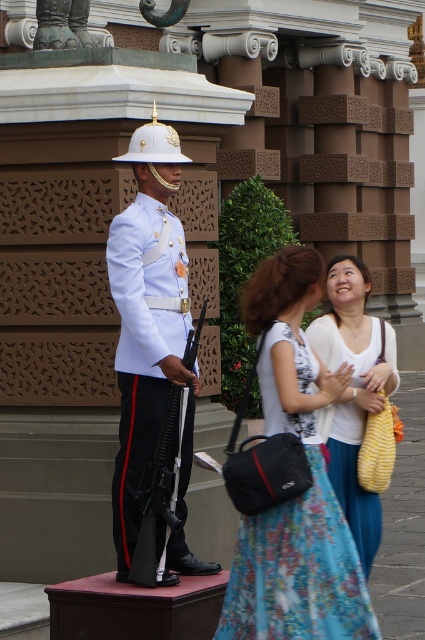
Can you confirm if floral dress at center is bigger than white fabric dress at center?

Correct, floral dress at center is larger in size than white fabric dress at center.

Is floral dress at center to the right of white fabric dress at center from the viewer's perspective?

In fact, floral dress at center is to the left of white fabric dress at center.

Is point (283, 611) positioned behind point (339, 323)?

No, (283, 611) is in front of (339, 323).

The width and height of the screenshot is (425, 640). In order to click on floral dress at center in this screenshot , I will do `click(302, 493)`.

Is point (292, 632) positioned behind point (360, 422)?

No, it is in front of (360, 422).

Can you confirm if floral cotton dress at lower center is taller than white fabric dress at center?

In fact, floral cotton dress at lower center may be shorter than white fabric dress at center.

Find the location of a particular element. floral cotton dress at lower center is located at coordinates (295, 536).

Can you confirm if floral dress at center is shorter than floral cotton dress at lower center?

No.

Is point (268, 531) in front of point (319, 598)?

No, (268, 531) is behind (319, 598).

Identify the location of floral dress at center. (302, 493).